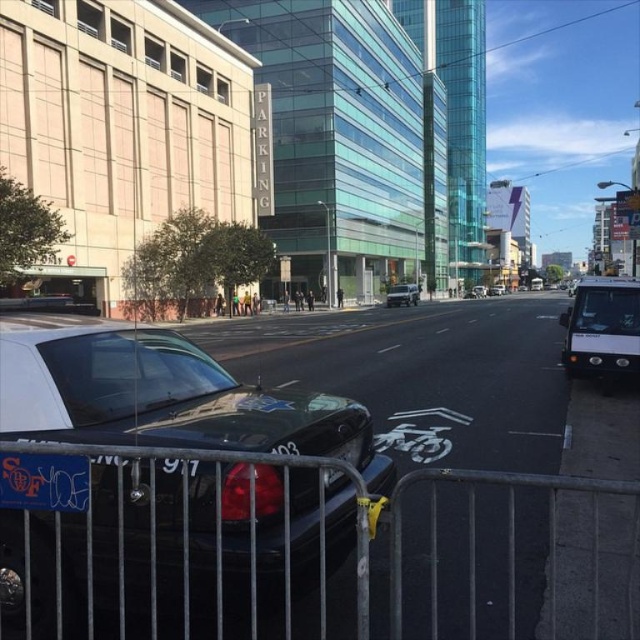
Is point (385, 465) closer to viewer compared to point (628, 344)?

Yes.

Can you confirm if matte black police car at center is smaller than white matte van at right?

Correct, matte black police car at center occupies less space than white matte van at right.

Is point (282, 417) positioned behind point (637, 364)?

That is False.

Find the location of `matte black police car at center`. matte black police car at center is located at coordinates (161, 396).

Can you confirm if matte black police car at center is bigger than metallic silver fence at lower center?

Correct, matte black police car at center is larger in size than metallic silver fence at lower center.

Which is more to the left, matte black police car at center or metallic silver fence at lower center?

From the viewer's perspective, matte black police car at center appears more on the left side.

Between point (150, 573) and point (358, 550), which one is positioned behind?

The point (150, 573) is more distant.

I want to click on matte black police car at center, so click(161, 396).

Does matte black police car at center have a greater width compared to black plastic license plate at center?

Yes, matte black police car at center is wider than black plastic license plate at center.

Where is `matte black police car at center`? The width and height of the screenshot is (640, 640). matte black police car at center is located at coordinates (161, 396).